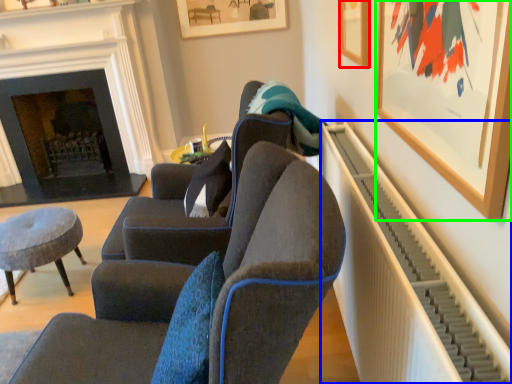
Question: Based on their relative distances, which object is farther from picture frame (highlighted by a red box)? Choose from radiator (highlighted by a blue box) and picture frame (highlighted by a green box).

Choices:
 (A) radiator
 (B) picture frame

Answer: (A)